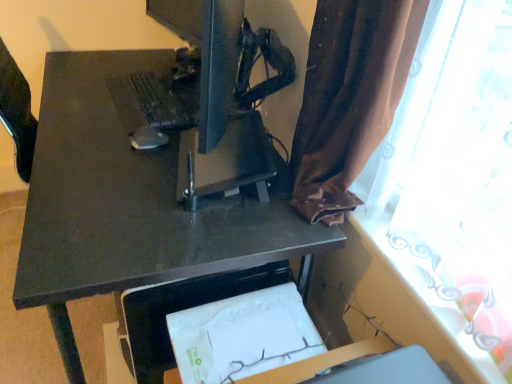
What are the coordinates of `matte black desk at center` in the screenshot? It's located at (126, 204).

Image resolution: width=512 pixels, height=384 pixels. Describe the element at coordinates (158, 102) in the screenshot. I see `matte black keyboard at upper left` at that location.

Consider the image. What is the approximate width of matte black monitor at center?

The width of matte black monitor at center is 1.67 inches.

Find the location of a particular element. Image resolution: width=512 pixels, height=384 pixels. matte black monitor at center is located at coordinates (218, 68).

You are a GUI agent. You are given a task and a screenshot of the screen. Output one action in this format:
    pyautogui.click(x=<x>, y=<y>)
    Task: Click on the brown fabric curtain at upper right
    The image size is (512, 384).
    Given the screenshot: What is the action you would take?
    pyautogui.click(x=454, y=180)

Where is `matte black desk at center`? matte black desk at center is located at coordinates [126, 204].

From a real-world perspective, relative to matte black mouse at center, is matte black keyboard at upper left vertically above or below?

Clearly, from a real-world perspective, matte black keyboard at upper left is below matte black mouse at center.

Is the depth of matte black keyboard at upper left greater than that of matte black mouse at center?

That is True.

Considering the points (157, 99) and (147, 125), which point is behind, point (157, 99) or point (147, 125)?

The point (157, 99) is farther from the camera.

From the picture: Is matte black keyboard at upper left placed right next to matte black mouse at center?

No, matte black keyboard at upper left is not making contact with matte black mouse at center.

Which is less distant, (x=200, y=99) or (x=160, y=131)?

The point (x=200, y=99) is more forward.

Which object is further away from the camera, matte black monitor at center or matte black mouse at center?

matte black mouse at center is further away from the camera.

Identify the location of mouse below the matte black monitor at center (from a real-world perspective). The width and height of the screenshot is (512, 384). (148, 138).

Based on the photo, from the image's perspective, who appears lower, matte black monitor at center or matte black mouse at center?

matte black mouse at center.

Is matte black keyboard at upper left positioned before brown fabric curtain at upper right?

No, the depth of matte black keyboard at upper left is greater than that of brown fabric curtain at upper right.

Is matte black keyboard at upper left inside or outside of brown fabric curtain at upper right?

matte black keyboard at upper left cannot be found inside brown fabric curtain at upper right.

Considering the relative sizes of matte black keyboard at upper left and brown fabric curtain at upper right in the image provided, is matte black keyboard at upper left smaller than brown fabric curtain at upper right?

No, matte black keyboard at upper left is not smaller than brown fabric curtain at upper right.

Which object is positioned more to the right, matte black keyboard at upper left or brown fabric curtain at upper right?

From the viewer's perspective, brown fabric curtain at upper right appears more on the right side.

Based on the photo, from a real-world perspective, is matte black monitor at center physically above brown fabric curtain at upper right?

Yes, from a real-world perspective, matte black monitor at center is above brown fabric curtain at upper right.

Consider the image. Who is more distant, matte black monitor at center or brown fabric curtain at upper right?

Positioned behind is matte black monitor at center.

Looking at this image, how many degrees apart are the facing directions of matte black monitor at center and brown fabric curtain at upper right?

The angular difference between matte black monitor at center and brown fabric curtain at upper right is 20.3 degrees.

How far apart are matte black monitor at center and brown fabric curtain at upper right?

21.18 inches.

Does matte black monitor at center have a larger size compared to matte black keyboard at upper left?

Yes, matte black monitor at center is bigger than matte black keyboard at upper left.

Could matte black keyboard at upper left be considered to be inside matte black monitor at center?

Definitely not — matte black keyboard at upper left is not inside matte black monitor at center.

Is matte black monitor at center wider or thinner than matte black keyboard at upper left?

matte black monitor at center is thinner than matte black keyboard at upper left.

Is matte black monitor at center facing away from matte black keyboard at upper left?

No, matte black keyboard at upper left is not at the back of matte black monitor at center.

Can you confirm if matte black monitor at center is shorter than matte black desk at center?

Correct, matte black monitor at center is not as tall as matte black desk at center.

Is matte black monitor at center far from matte black desk at center?

No.

From a real-world perspective, is matte black monitor at center positioned above or below matte black desk at center?

matte black monitor at center is situated higher than matte black desk at center in the real world.

How different are the orientations of matte black keyboard at upper left and matte black desk at center in degrees?

The facing directions of matte black keyboard at upper left and matte black desk at center are 3.03 degrees apart.

Locate an element on the screen. The image size is (512, 384). laptop keyboard on the left of matte black desk at center is located at coordinates (158, 102).

From a real-world perspective, is matte black keyboard at upper left physically located above or below matte black desk at center?

matte black keyboard at upper left is above matte black desk at center.

In terms of size, does matte black keyboard at upper left appear bigger or smaller than matte black desk at center?

Clearly, matte black keyboard at upper left is smaller in size than matte black desk at center.

Locate an element on the screen. This screenshot has width=512, height=384. mouse that is on the right side of matte black keyboard at upper left is located at coordinates (148, 138).

The width and height of the screenshot is (512, 384). In order to click on mouse below the matte black monitor at center (from the image's perspective) in this screenshot , I will do `click(148, 138)`.

Which object lies nearer to the anchor point matte black desk at center, matte black monitor at center or matte black mouse at center?

matte black mouse at center.

Considering their positions, is matte black mouse at center positioned closer to matte black monitor at center than brown fabric curtain at upper right?

Among the two, matte black mouse at center is located nearer to matte black monitor at center.

Looking at the image, which one is located further to matte black keyboard at upper left, matte black mouse at center or matte black monitor at center?

Among the two, matte black monitor at center is located further to matte black keyboard at upper left.

Considering their positions, is matte black mouse at center positioned further to matte black desk at center than brown fabric curtain at upper right?

Among the two, brown fabric curtain at upper right is located further to matte black desk at center.

Looking at the image, which one is located closer to matte black desk at center, matte black monitor at center or brown fabric curtain at upper right?

The object closer to matte black desk at center is matte black monitor at center.

When comparing their distances from matte black mouse at center, does matte black desk at center or matte black keyboard at upper left seem closer?

matte black keyboard at upper left is closer to matte black mouse at center.

When comparing their distances from brown fabric curtain at upper right, does matte black monitor at center or matte black desk at center seem further?

matte black monitor at center.

Considering their positions, is matte black desk at center positioned further to matte black mouse at center than matte black monitor at center?

matte black monitor at center is positioned further to the anchor matte black mouse at center.

Locate an element on the screen. computer monitor located between matte black mouse at center and brown fabric curtain at upper right in the left-right direction is located at coordinates (218, 68).

At what (x,y) coordinates should I click in order to perform the action: click on desk between matte black monitor at center and matte black keyboard at upper left in the front-back direction. Please return your answer as a coordinate pair (x, y). The width and height of the screenshot is (512, 384). Looking at the image, I should click on (126, 204).

Identify the location of mouse between matte black desk at center and matte black keyboard at upper left in the front-back direction. (148, 138).

The image size is (512, 384). What are the coordinates of `desk positioned between matte black monitor at center and matte black mouse at center from near to far` in the screenshot? It's located at (126, 204).